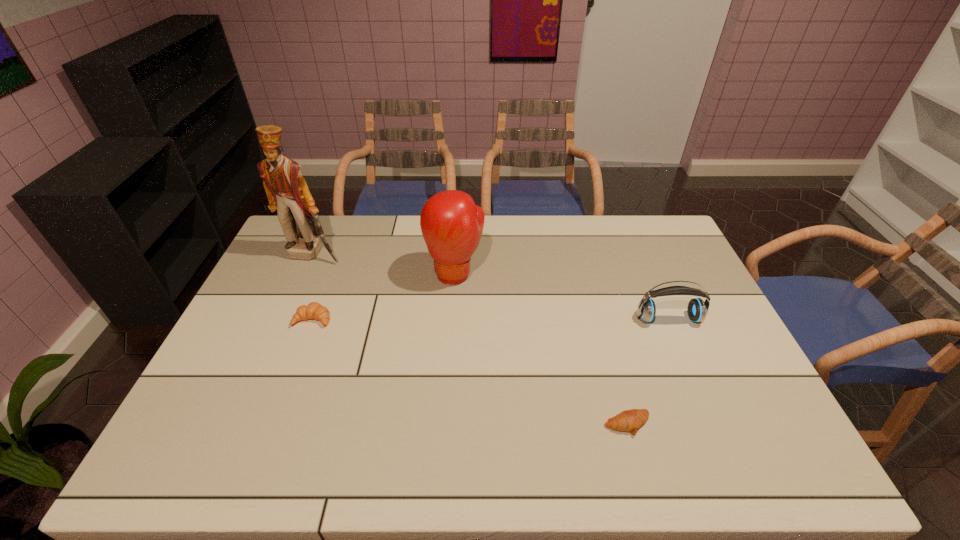
Image resolution: width=960 pixels, height=540 pixels. Find the location of `nutcracker`. nutcracker is located at coordinates (287, 191).

The height and width of the screenshot is (540, 960). I want to click on the second tallest object, so click(x=451, y=224).

Image resolution: width=960 pixels, height=540 pixels. I want to click on the third object from right to left, so click(x=451, y=224).

Find the location of a particular element. The height and width of the screenshot is (540, 960). the rightmost object is located at coordinates (697, 309).

At what (x,y) coordinates should I click in order to perform the action: click on the third tallest object. Please return your answer as a coordinate pair (x, y). Image resolution: width=960 pixels, height=540 pixels. Looking at the image, I should click on (697, 309).

At what (x,y) coordinates should I click in order to perform the action: click on the left crescent roll. Please return your answer as a coordinate pair (x, y). The image size is (960, 540). Looking at the image, I should click on (314, 310).

The height and width of the screenshot is (540, 960). I want to click on the second shortest object, so click(314, 310).

Identify the location of the nearest object. (629, 420).

Identify the location of the shortest object. (629, 420).

Where is `free point located on the front-facing side of the nutcracker`? Image resolution: width=960 pixels, height=540 pixels. free point located on the front-facing side of the nutcracker is located at coordinates (294, 298).